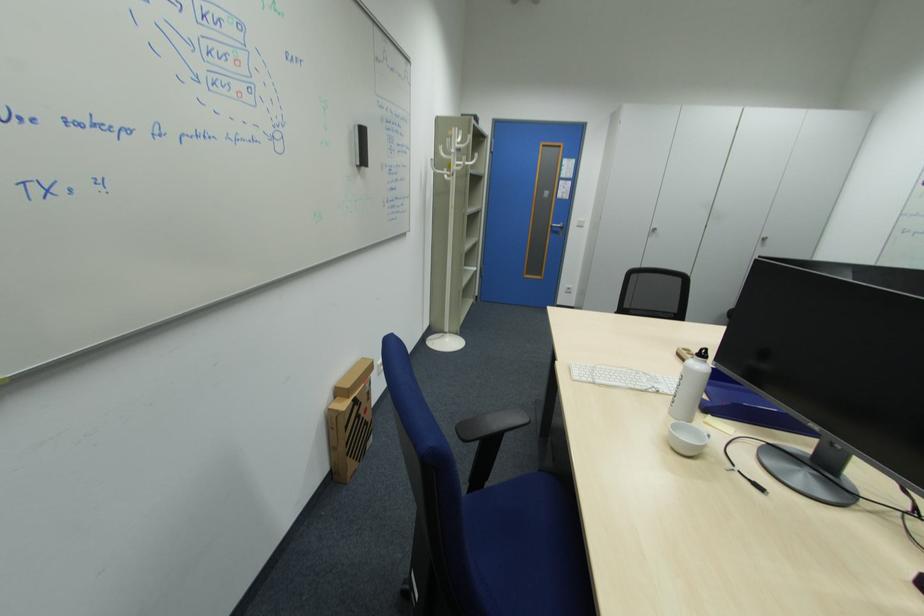
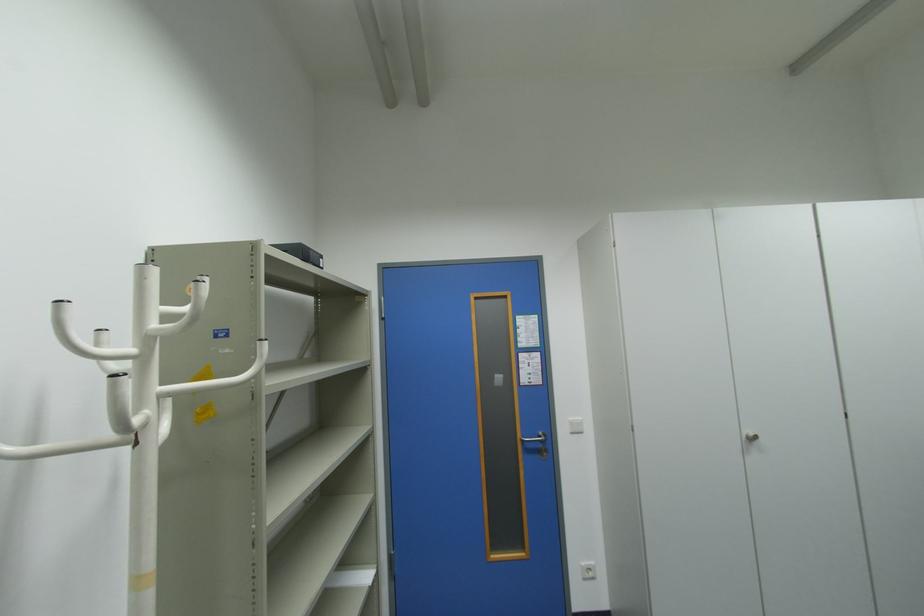
Question: What movement of the cameraman would produce the second image?

Choices:
 (A) Left
 (B) Right
 (C) Forward
 (D) Backward

Answer: (C)